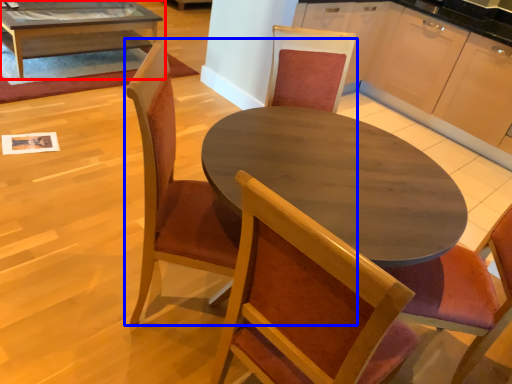
Question: Which object is closer to the camera taking this photo, coffee table (highlighted by a red box) or chair (highlighted by a blue box)?

Choices:
 (A) coffee table
 (B) chair

Answer: (B)